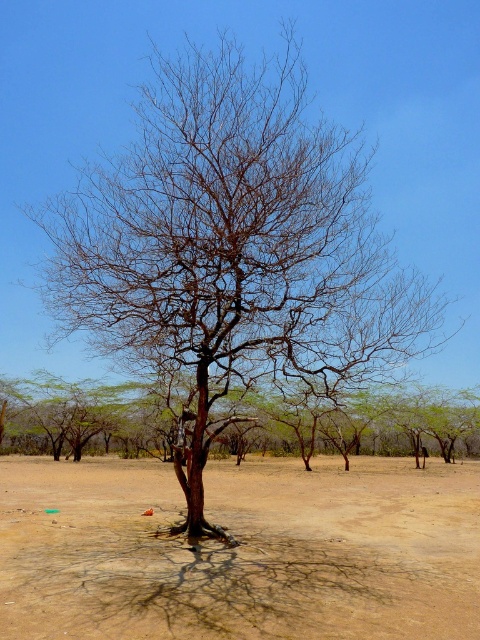
Who is positioned more to the left, brown sandy dirt at center or brown bark tree at center?

Positioned to the left is brown bark tree at center.

Is brown sandy dirt at center thinner than brown bark tree at center?

Indeed, brown sandy dirt at center has a lesser width compared to brown bark tree at center.

Measure the distance between brown sandy dirt at center and camera.

brown sandy dirt at center and camera are 4.11 meters apart from each other.

Locate an element on the screen. Image resolution: width=480 pixels, height=640 pixels. brown sandy dirt at center is located at coordinates (240, 552).